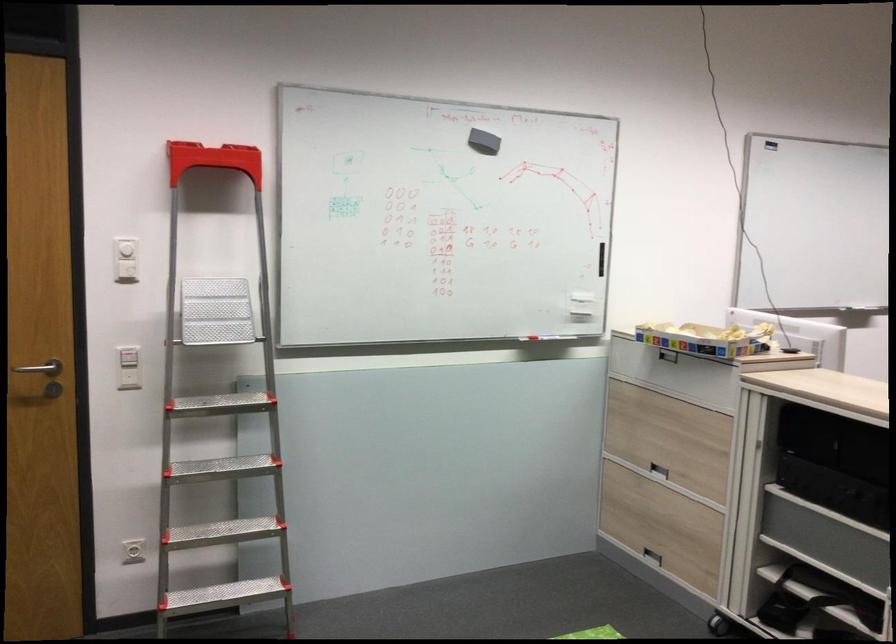
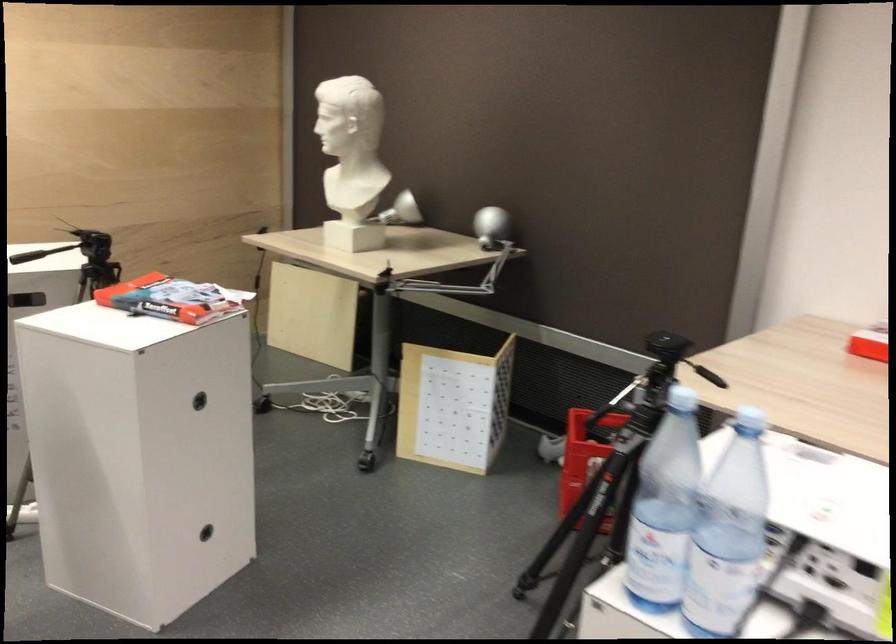
Question: The images are taken continuously from a first-person perspective. In which direction are you moving?

Choices:
 (A) Left
 (B) Right
 (C) Forward
 (D) Backward

Answer: (B)